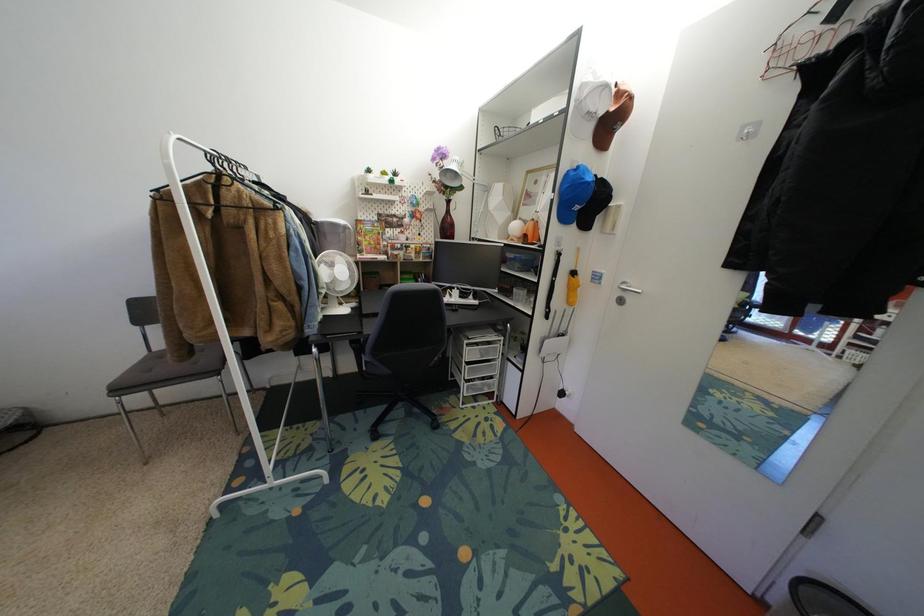
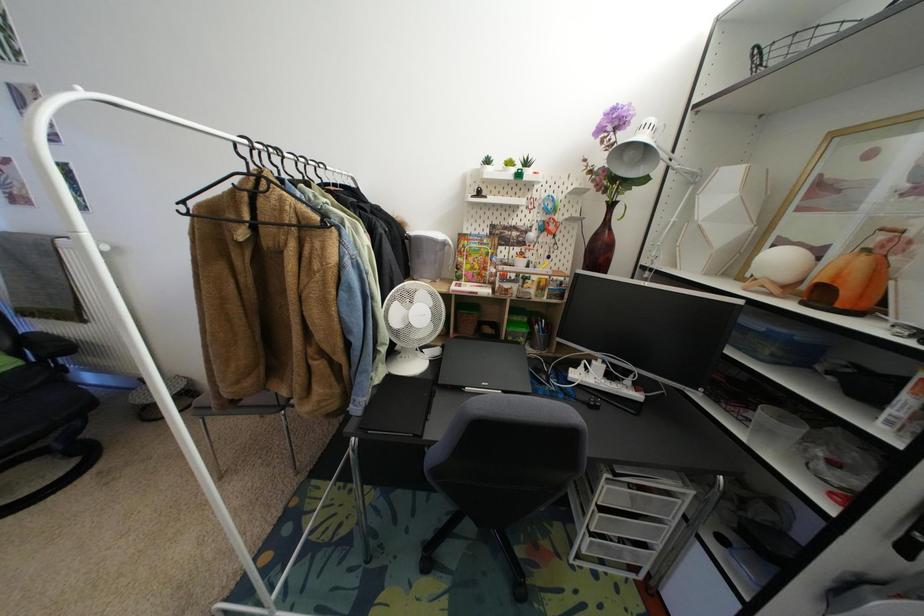
Question: The first image is from the beginning of the video and the second image is from the end. How did the camera likely rotate when shooting the video?

Choices:
 (A) Left
 (B) Right
 (C) Up
 (D) Down

Answer: (A)